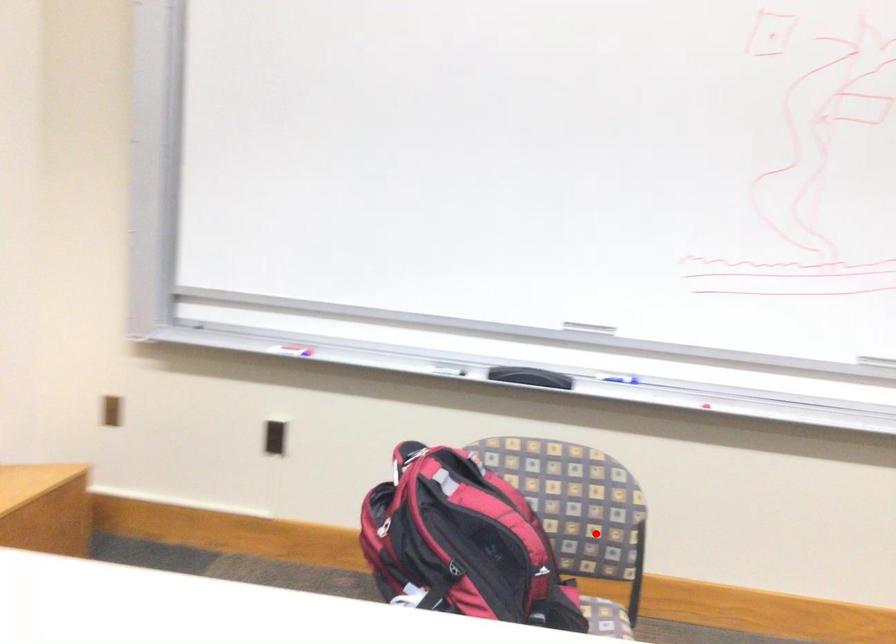
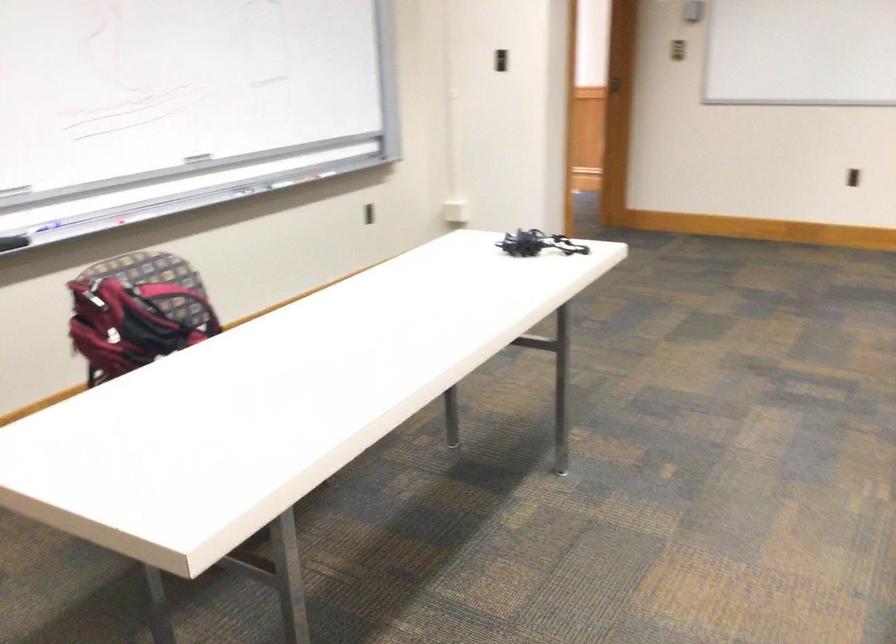
Find the pixel in the second image that matches the highlighted location in the first image.

(177, 301)